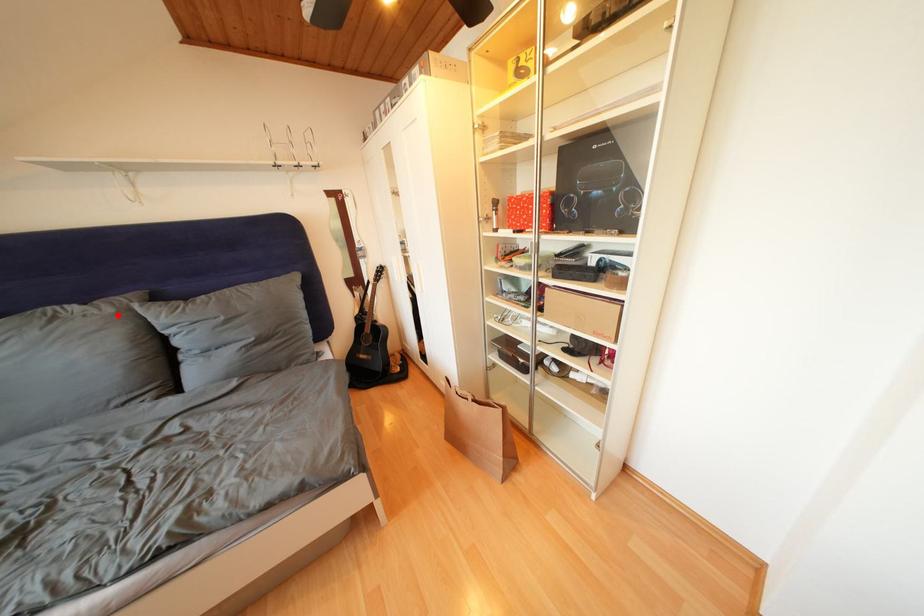
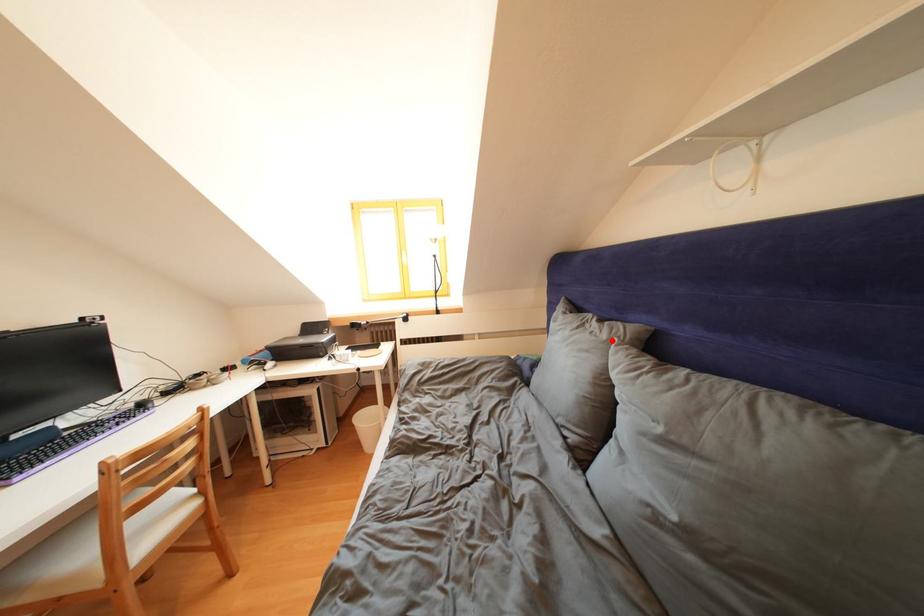
I am providing you with two images of the same scene from different viewpoints. A red point is marked on the first image and another point is marked on the second image. Is the red point in image1 aligned with the point shown in image2?

Yes